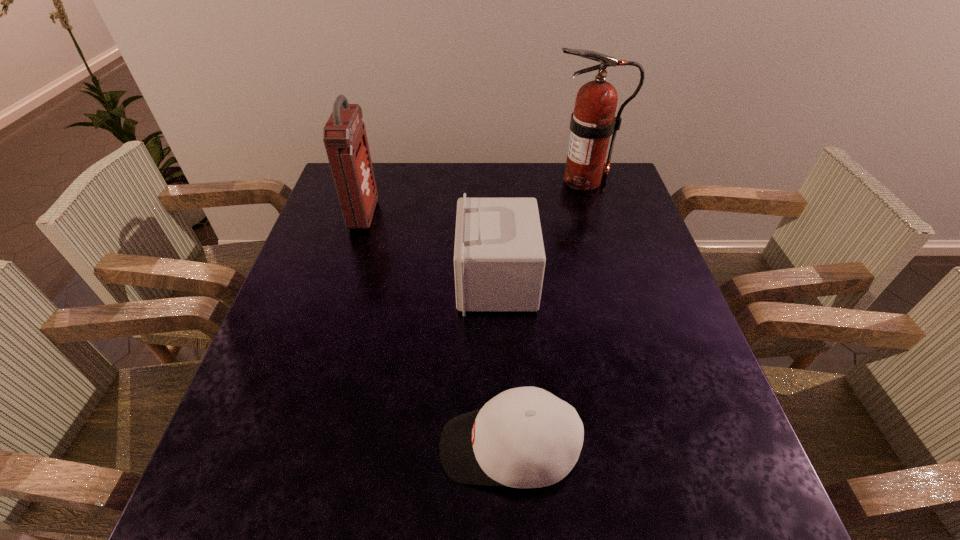
At what (x,y) coordinates should I click in order to perform the action: click on the rightmost object. Please return your answer as a coordinate pair (x, y). The height and width of the screenshot is (540, 960). Looking at the image, I should click on 593,121.

In order to click on fire extinguisher in this screenshot , I will do `click(593, 121)`.

Identify the location of the third shortest object. (344, 135).

Where is `the leftmost object`? the leftmost object is located at coordinates pos(344,135).

This screenshot has width=960, height=540. I want to click on the shorter first-aid kit, so click(x=499, y=259).

At what (x,y) coordinates should I click in order to perform the action: click on the third farthest object. Please return your answer as a coordinate pair (x, y). Image resolution: width=960 pixels, height=540 pixels. Looking at the image, I should click on (499, 259).

Where is `the shortest object`? the shortest object is located at coordinates (525, 437).

I want to click on the nearest object, so click(x=525, y=437).

Locate an element on the screen. This screenshot has height=540, width=960. blank space located 0.390m at the nozzle of the farthest object is located at coordinates (424, 180).

Image resolution: width=960 pixels, height=540 pixels. What are the coordinates of `free spot located at the nozzle of the farthest object` in the screenshot? It's located at (509, 180).